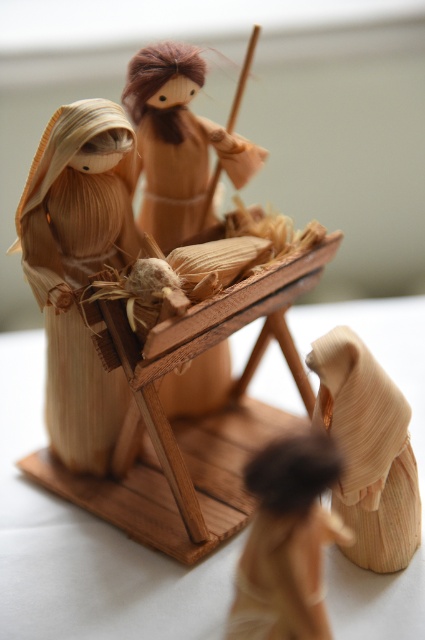
Based on the photo, does natural straw figure at left appear under wooden figure at center?

Yes, natural straw figure at left is below wooden figure at center.

Between point (56, 417) and point (138, 145), which one is positioned behind?

The point (56, 417) is behind.

Which is behind, point (125, 225) or point (147, 170)?

The point (147, 170) is more distant.

Locate an element on the screen. The image size is (425, 640). natural straw figure at left is located at coordinates (x=79, y=266).

Looking at this image, is natural straw figure at left taller than wooden baby at center?

Indeed, natural straw figure at left has a greater height compared to wooden baby at center.

Can you confirm if natural straw figure at left is shorter than wooden baby at center?

No.

Who is more distant from viewer, [84,160] or [350,381]?

Positioned behind is point [84,160].

This screenshot has height=640, width=425. I want to click on natural straw figure at left, so click(x=79, y=266).

Does wooden baby at center lie in front of wooden shepherd at lower right?

No, it is behind wooden shepherd at lower right.

Consider the image. Which is above, wooden baby at center or wooden shepherd at lower right?

wooden baby at center is above.

Where is `wooden baby at center`? wooden baby at center is located at coordinates (368, 451).

Locate an element on the screen. wooden baby at center is located at coordinates (368, 451).